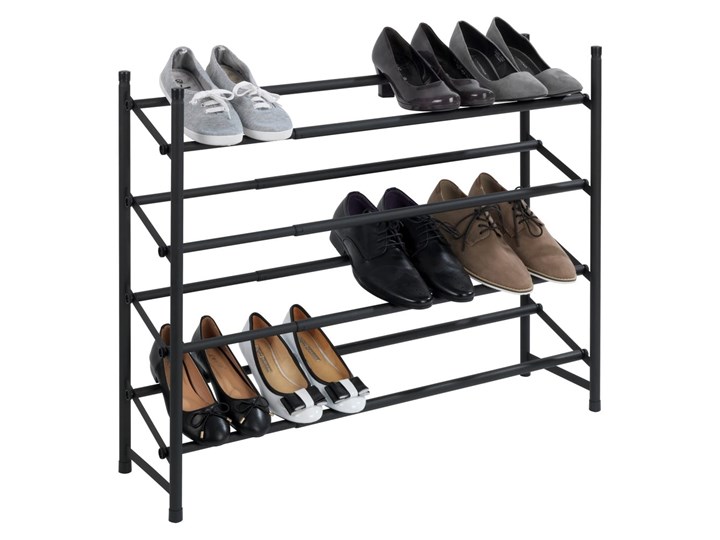
Where is `shoe pairs`? Image resolution: width=720 pixels, height=540 pixels. shoe pairs is located at coordinates (246, 131), (428, 106), (530, 96), (526, 244), (407, 249), (356, 340), (207, 392).